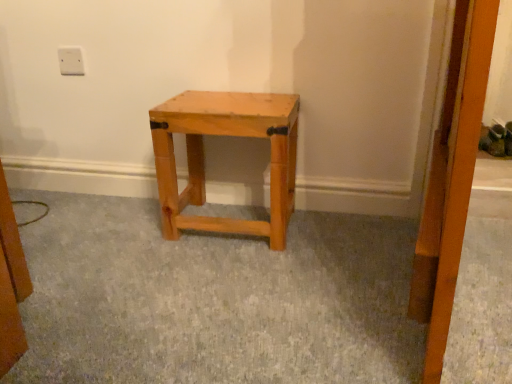
Image resolution: width=512 pixels, height=384 pixels. I want to click on free space in front of natural wood stool at center, so click(227, 274).